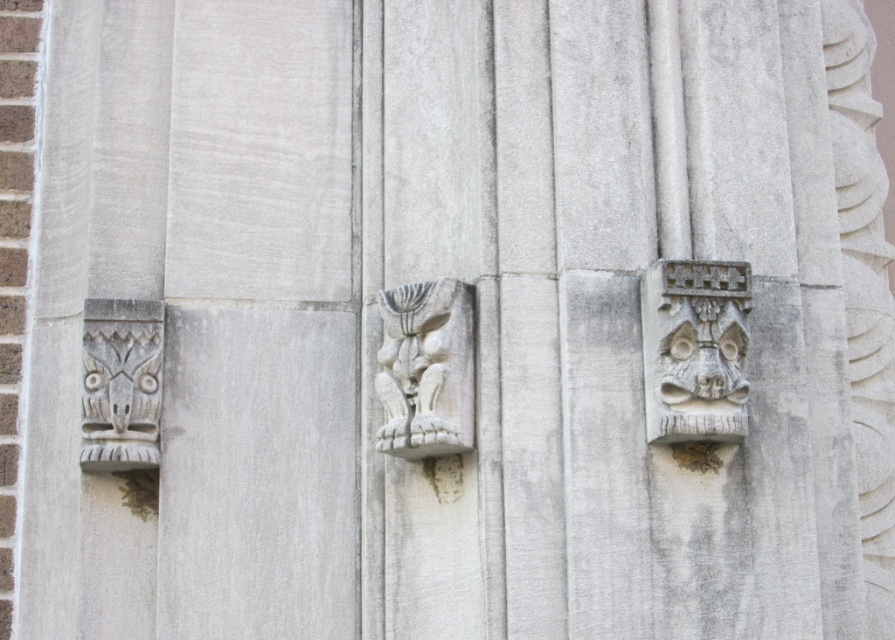
Question: Is white stone mask at right above white stone carving at left?

Choices:
 (A) yes
 (B) no

Answer: (A)

Question: Among these points, which one is farthest from the camera?

Choices:
 (A) (717, 301)
 (B) (450, 449)

Answer: (B)

Question: Which object appears farthest from the camera in this image?

Choices:
 (A) white stone carving at center
 (B) white stone carving at left
 (C) white stone mask at right

Answer: (B)

Question: Can you confirm if white stone mask at right is smaller than white stone carving at left?

Choices:
 (A) no
 (B) yes

Answer: (A)

Question: Is white stone carving at center below white stone carving at left?

Choices:
 (A) yes
 (B) no

Answer: (B)

Question: Estimate the real-world distances between objects in this image. Which object is farther from the white stone carving at center?

Choices:
 (A) white stone carving at left
 (B) white stone mask at right

Answer: (A)